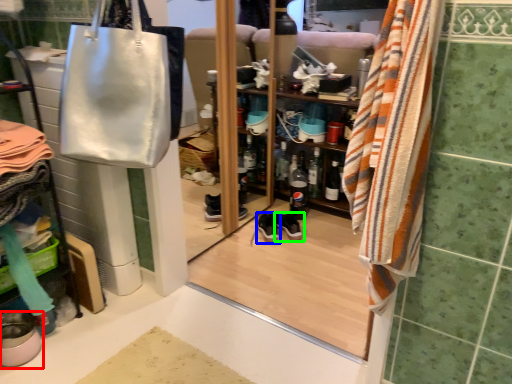
Question: Which object is the farthest from footwear (highlighted by a red box)? Choose among these: shoe (highlighted by a blue box) or footwear (highlighted by a green box).

Choices:
 (A) shoe
 (B) footwear

Answer: (B)